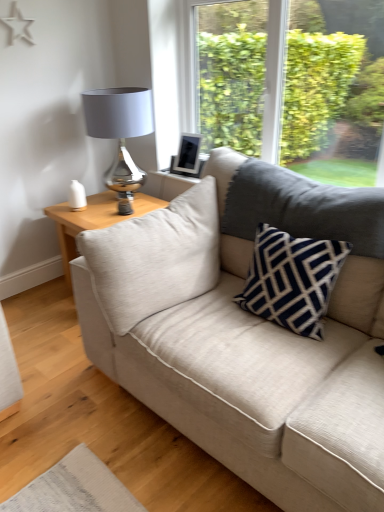
Question: Is beige fabric couch at center wider or thinner than light wood/texture side table at left?

Choices:
 (A) thin
 (B) wide

Answer: (B)

Question: In the image, is beige fabric couch at center positioned in front of or behind light wood/texture side table at left?

Choices:
 (A) behind
 (B) front

Answer: (B)

Question: Which object is positioned closest to the beige fabric couch at center?

Choices:
 (A) light wood/texture side table at left
 (B) matte silver table lamp at upper left
 (C) navy blue textured pillow at center

Answer: (C)

Question: Which of these objects is positioned closest to the beige fabric couch at center?

Choices:
 (A) light wood/texture side table at left
 (B) matte silver table lamp at upper left
 (C) navy blue textured pillow at center

Answer: (C)